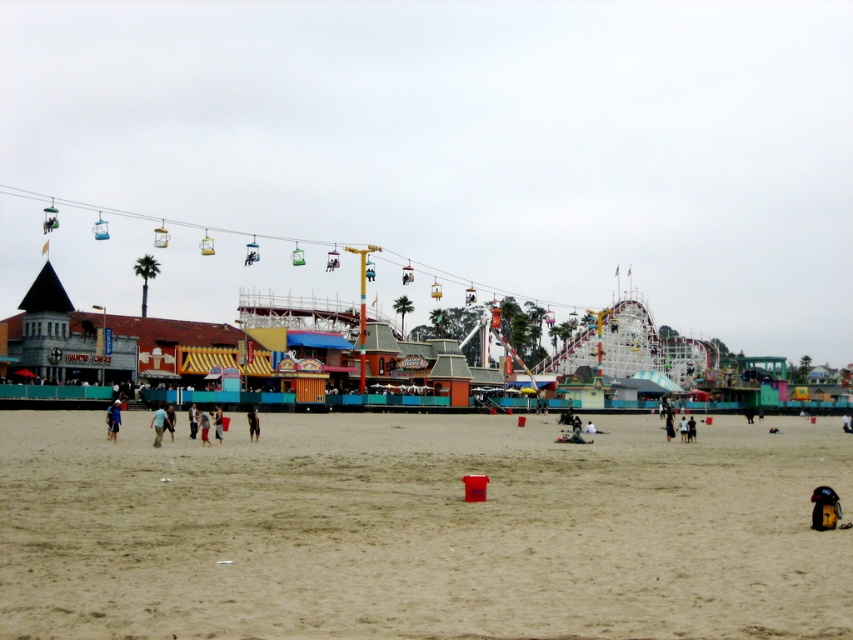
Does blue denim shorts at lower left appear under dark blue jeans at center?

No, blue denim shorts at lower left is not below dark blue jeans at center.

Between blue denim shorts at lower left and dark blue jeans at center, which one has less height?

dark blue jeans at center

Does point (108, 406) come closer to viewer compared to point (160, 401)?

Yes.

The image size is (853, 640). What are the coordinates of `blue denim shorts at lower left` in the screenshot? It's located at (113, 419).

Can you confirm if fine-grained sand at center is positioned to the left of dark blue jeans at center?

Incorrect, fine-grained sand at center is not on the left side of dark blue jeans at center.

Is fine-grained sand at center thinner than dark blue jeans at center?

No, fine-grained sand at center is not thinner than dark blue jeans at center.

The image size is (853, 640). I want to click on fine-grained sand at center, so click(421, 529).

Where is `fine-grained sand at center`? fine-grained sand at center is located at coordinates (421, 529).

Is blue denim shorts at lower left smaller than dark blue shorts at center?

No.

Based on the photo, is blue denim shorts at lower left positioned in front of dark blue shorts at center?

That is True.

Is point (112, 403) closer to viewer compared to point (254, 417)?

No, it is behind (254, 417).

In order to click on blue denim shorts at lower left in this screenshot , I will do `click(113, 419)`.